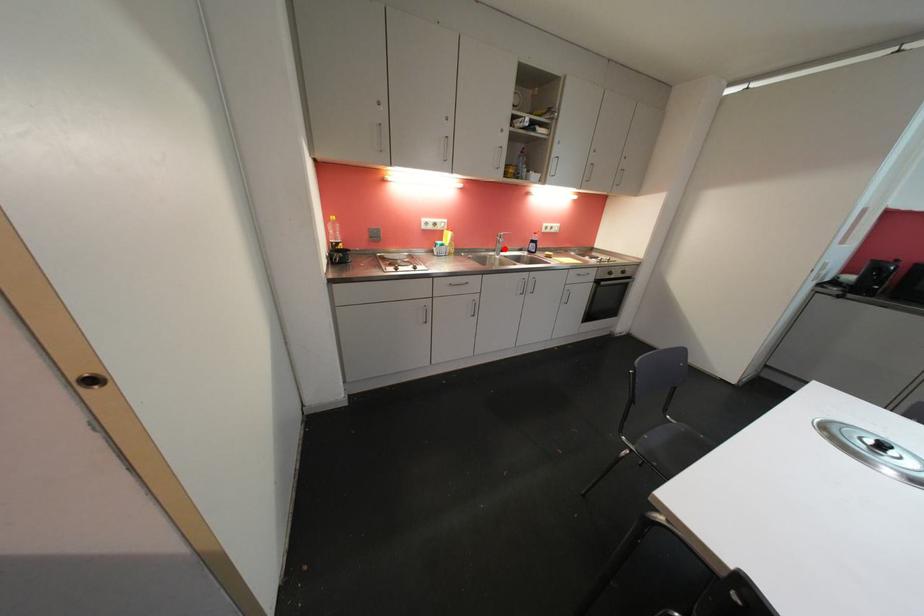
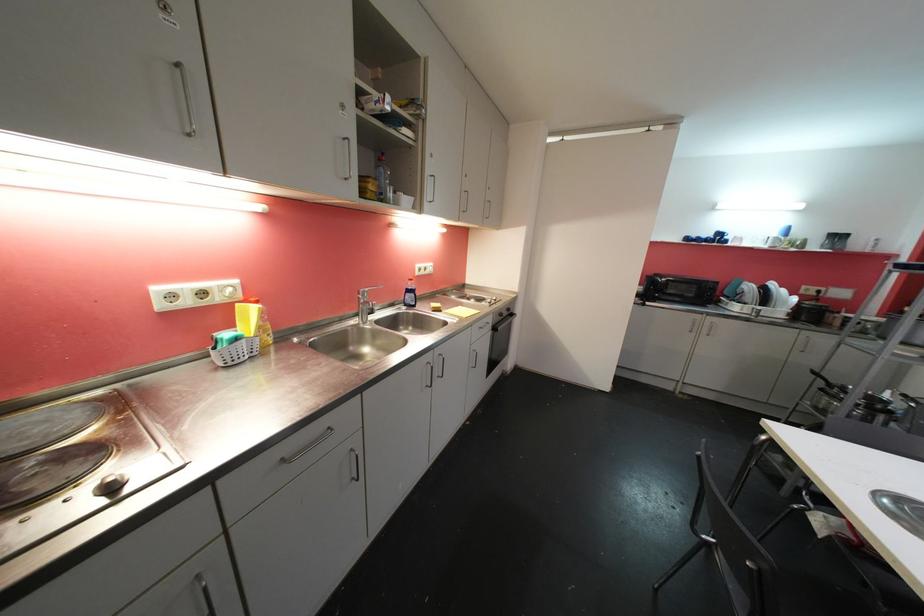
Question: I am providing you with two images of the same scene from different viewpoints. In image1, a red point is highlighted. Considering the same 3D point in image2, which of the following is correct?

Choices:
 (A) It is closer
 (B) It is farther

Answer: (B)